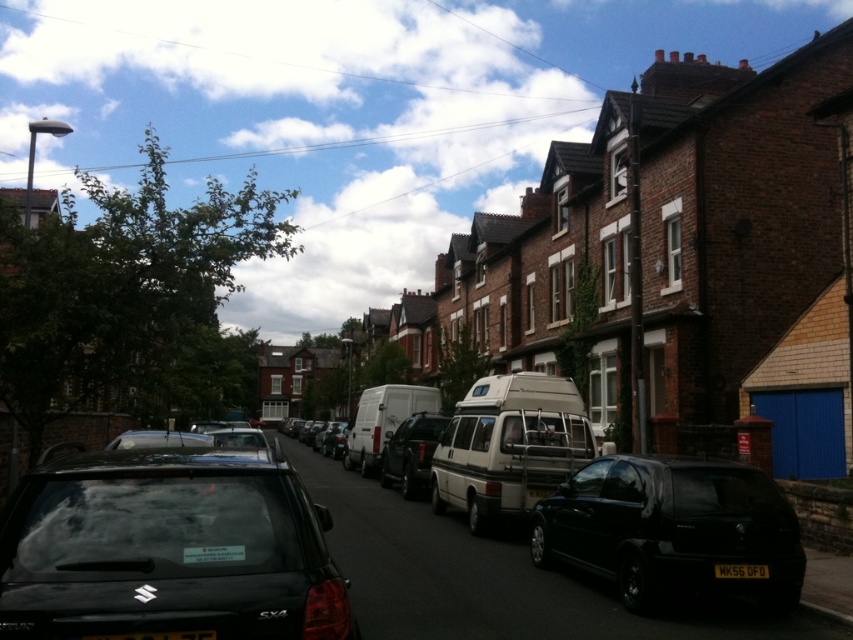
Which is above, black matte hatchback at center or white matte van at center?

Positioned higher is black matte hatchback at center.

Measure the distance between black matte hatchback at center and camera.

The distance of black matte hatchback at center from camera is 6.73 meters.

Is point (659, 586) closer to viewer compared to point (367, 468)?

Yes, point (659, 586) is closer to viewer.

Where is `black matte hatchback at center`? black matte hatchback at center is located at coordinates (671, 529).

Identify the location of matte black van at center. (410, 452).

Can you confirm if black matte hatchback at center is thinner than matte black van at center?

No, black matte hatchback at center is not thinner than matte black van at center.

Describe the element at coordinates (671, 529) in the screenshot. I see `black matte hatchback at center` at that location.

This screenshot has height=640, width=853. Identify the location of black matte hatchback at center. (671, 529).